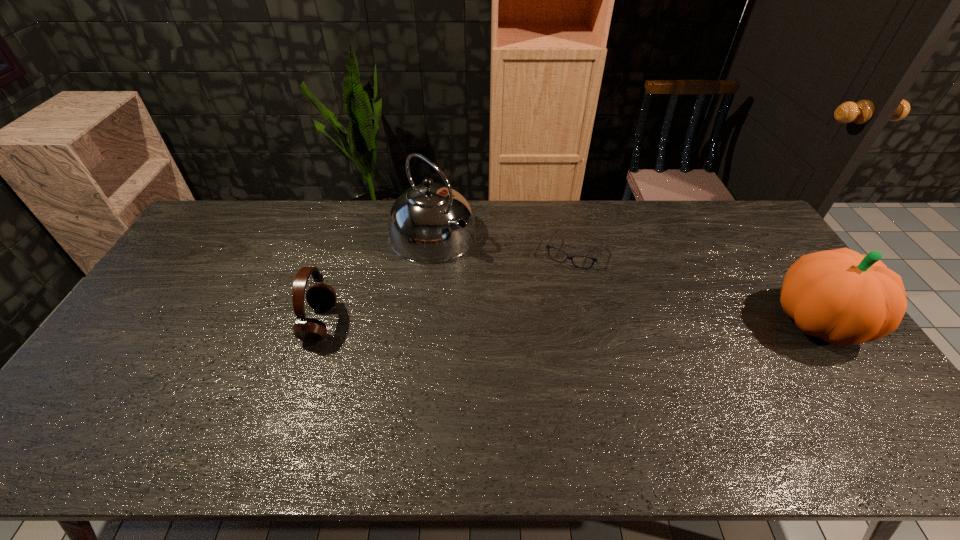
Locate an element on the screen. The height and width of the screenshot is (540, 960). free space between the third tallest object and the kettle is located at coordinates (376, 279).

I want to click on free area in between the pumpkin and the third object from right to left, so click(x=625, y=278).

What are the coordinates of `object that is the second closest to the rightmost object` in the screenshot? It's located at (430, 223).

Identify which object is located as the third nearest to the spectacles. Please provide its 2D coordinates. Your answer should be formatted as a tuple, i.e. [(x, y)], where the tuple contains the x and y coordinates of a point satisfying the conditions above.

[(321, 297)]

Locate an element on the screen. vacant position in the image that satisfies the following two spatial constraints: 1. on the front side of the second object from left to right; 2. on the right side of the pumpkin is located at coordinates (422, 322).

Find the location of a particular element. The height and width of the screenshot is (540, 960). vacant space that satisfies the following two spatial constraints: 1. on the front side of the pumpkin; 2. on the left side of the kettle is located at coordinates [422, 322].